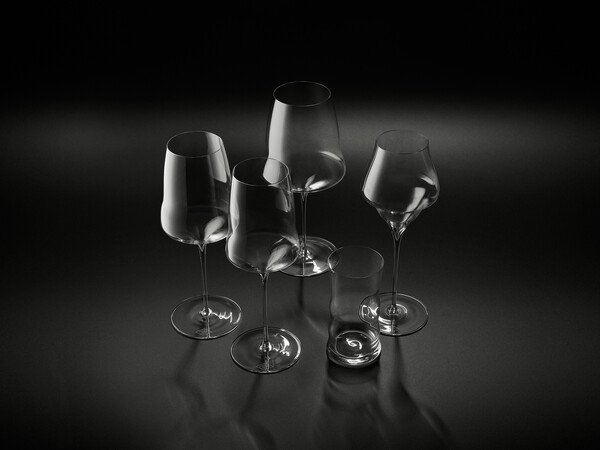
Identify the location of stemware. This screenshot has height=450, width=600. pos(201,286), pos(265,306), pos(304,226), pos(395,252).